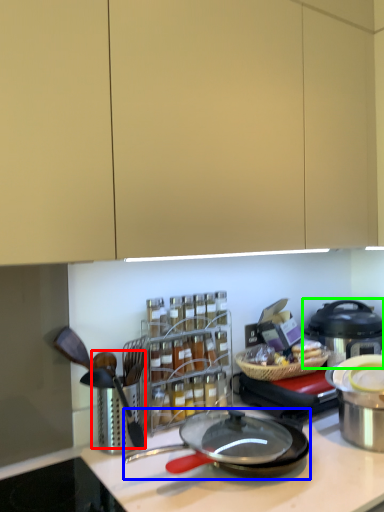
Question: Based on their relative distances, which object is farther from utensil (highlighted by a red box)? Choose from frying pan (highlighted by a blue box) and kitchen appliance (highlighted by a green box).

Choices:
 (A) frying pan
 (B) kitchen appliance

Answer: (B)